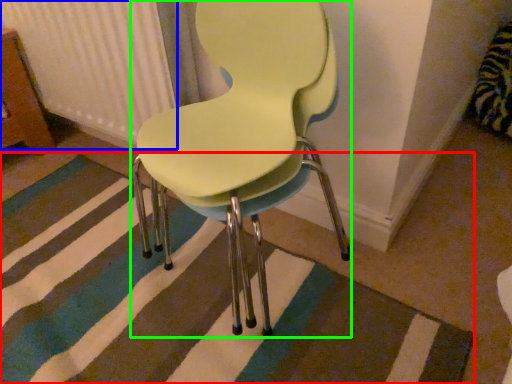
Question: Considering the real-world distances, which object is farthest from doormat (highlighted by a red box)? radiator (highlighted by a blue box) or chair (highlighted by a green box)?

Choices:
 (A) radiator
 (B) chair

Answer: (A)